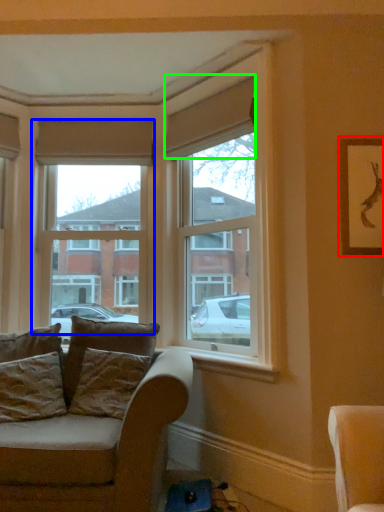
Question: Considering the real-world distances, which object is farthest from picture frame (highlighted by a red box)? window (highlighted by a blue box) or curtain (highlighted by a green box)?

Choices:
 (A) window
 (B) curtain

Answer: (A)